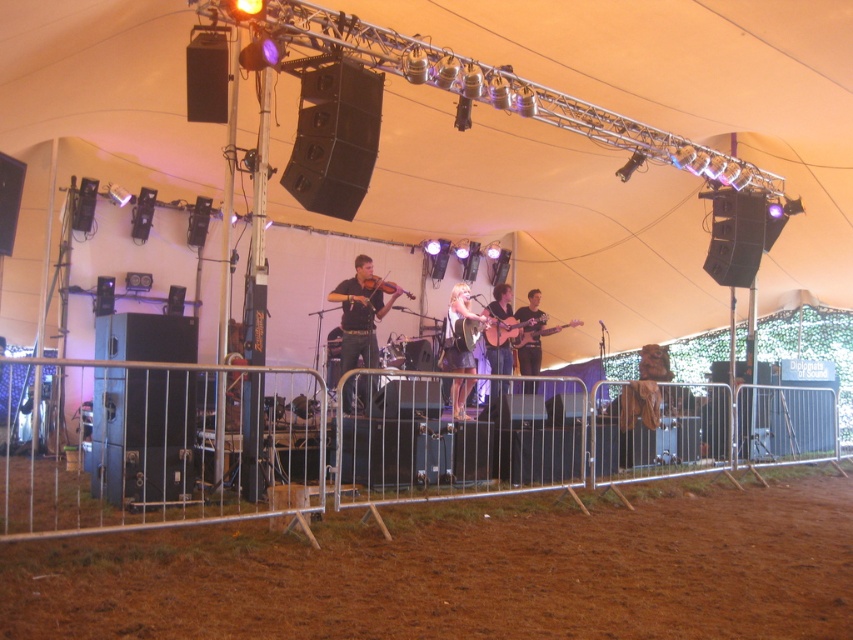
You are a sound technician adjusting the stage lights. The stage has a matte black violin at center. To ensure the violin is well lit, where should you position the spotlight relative to the violin?

The matte black violin at center is located at point (360, 316). To ensure proper lighting, position the spotlight directly above or slightly in front of this coordinate to illuminate the violin effectively.

You are a stagehand who needs to adjust the microphones for the two guitars. The light brown wood guitar at center and the matte black guitar at center are both on stage. Which guitar is located to the left of the other?

The light brown wood guitar at center is positioned on the left side of matte black guitar at center, so it is located to the left of the matte black guitar at center.

In the scene shown: You are a stagehand who needs to move a microphone stand from the light brown wood guitar at center to the nearest speaker. The microphone stand is 1.2 meters tall. Can you safely move it without hitting the microphone on any lights or the truss structure?

The light brown wood guitar at center and the nearest speaker are 7.72 meters apart. Since the microphone stand is only 1.2 meters tall, you can safely move it without hitting any obstacles as the distance is sufficient and the height of the stand is below the truss and lights.